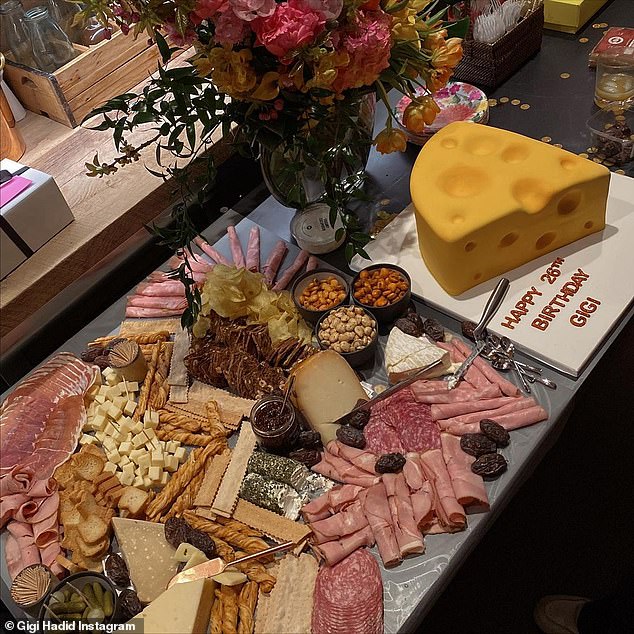
You are a GUI agent. You are given a task and a screenshot of the screen. Output one action in this format:
    pyautogui.click(x=<x>, y=<y>)
    Task: Click on the plastic under spread
    The width and height of the screenshot is (634, 634).
    Given the screenshot: What is the action you would take?
    pyautogui.click(x=418, y=581)